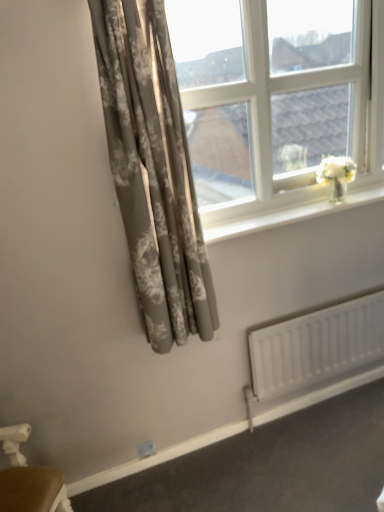
You are a GUI agent. You are given a task and a screenshot of the screen. Output one action in this format:
    pyautogui.click(x=<x>, y=<y>)
    Task: Click on the vacant region above white glossy window sill at upper center (from a real-world perspective)
    This screenshot has width=384, height=512.
    Given the screenshot: What is the action you would take?
    pyautogui.click(x=300, y=203)